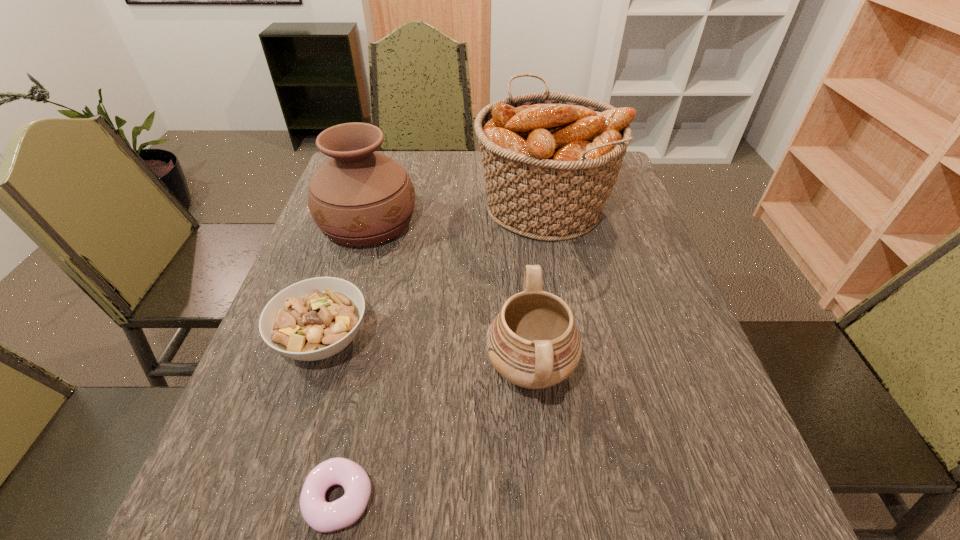
Find the location of a particular element. blank region between the shortest object and the stew is located at coordinates (331, 420).

Image resolution: width=960 pixels, height=540 pixels. What are the coordinates of `free spot between the fourth shortest object and the nearest object` in the screenshot? It's located at (353, 361).

Find the location of a particular element. free area in between the nearer urn and the shortest object is located at coordinates (435, 434).

Choose which object is the fourth nearest neighbor to the third shortest object. Please provide its 2D coordinates. Your answer should be formatted as a tuple, i.e. [(x, y)], where the tuple contains the x and y coordinates of a point satisfying the conditions above.

[(359, 197)]

Point out which object is positioned as the second nearest to the second shortest object. Please provide its 2D coordinates. Your answer should be formatted as a tuple, i.e. [(x, y)], where the tuple contains the x and y coordinates of a point satisfying the conditions above.

[(359, 197)]